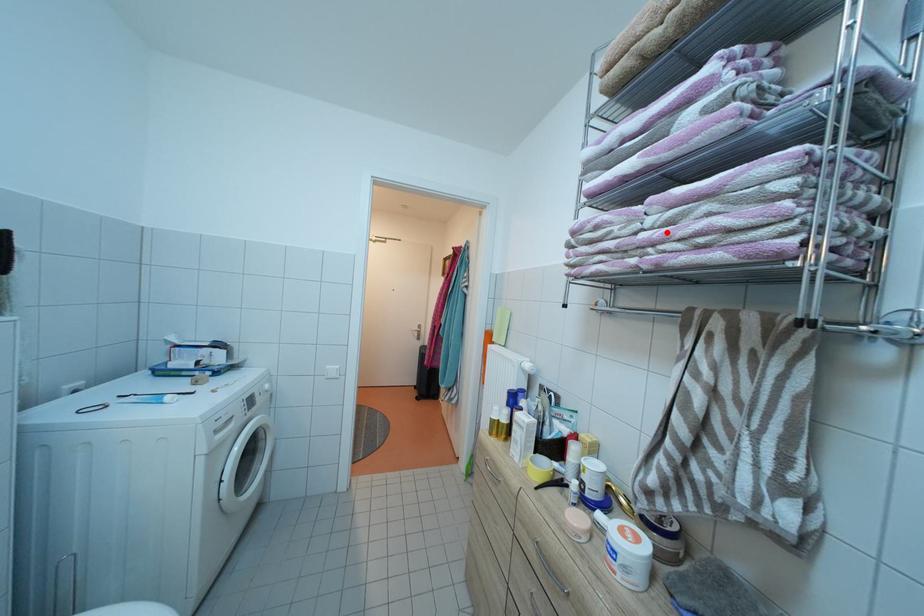
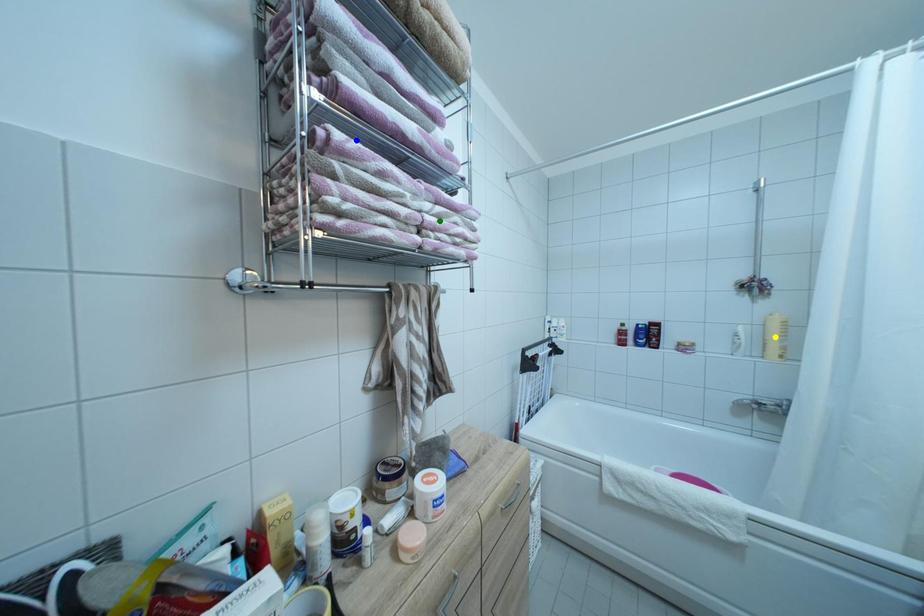
Question: I am providing you with two images of the same scene from different viewpoints. A red point is marked on the first image. You are given multiple points on the second image. Can you choose the point in image 2 that corresponds to the point in image 1?

Choices:
 (A) green point
 (B) blue point
 (C) yellow point

Answer: (A)